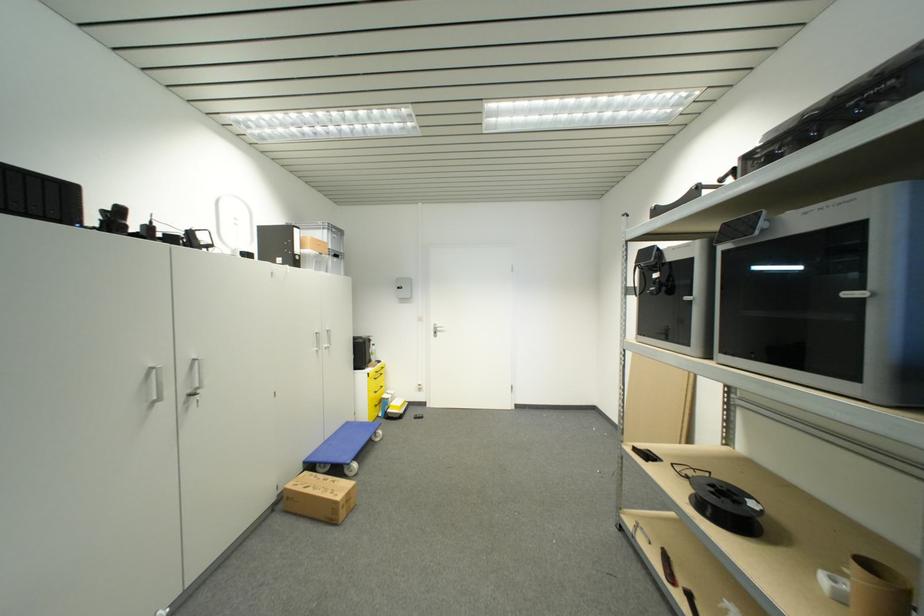
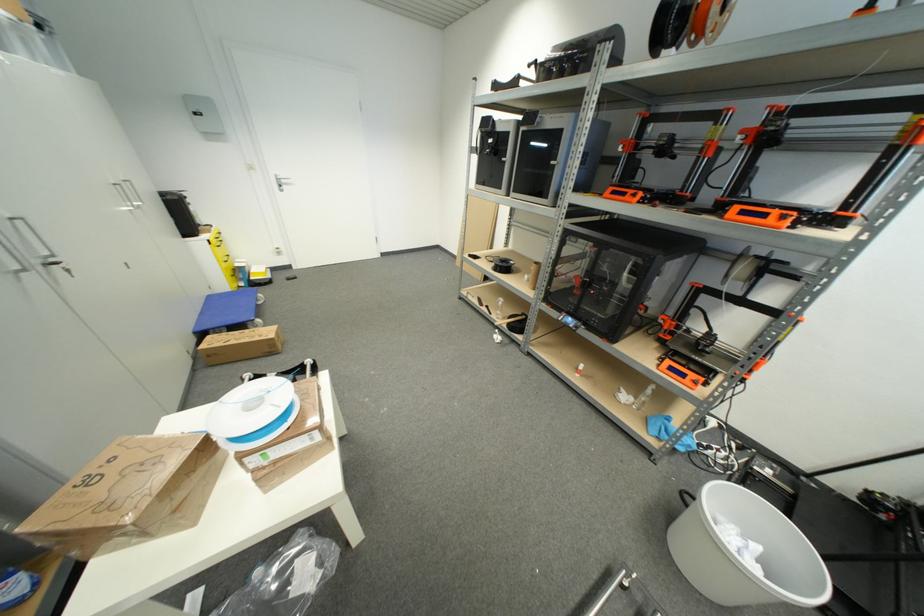
In the second image, find the point that corresponds to point (351, 426) in the first image.

(213, 299)